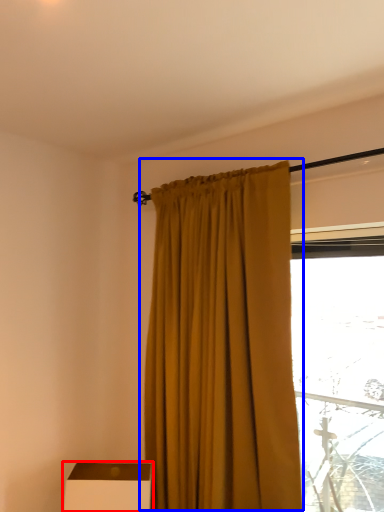
Question: Which point is further to the camera, furniture (highlighted by a red box) or curtain (highlighted by a blue box)?

Choices:
 (A) furniture
 (B) curtain

Answer: (A)